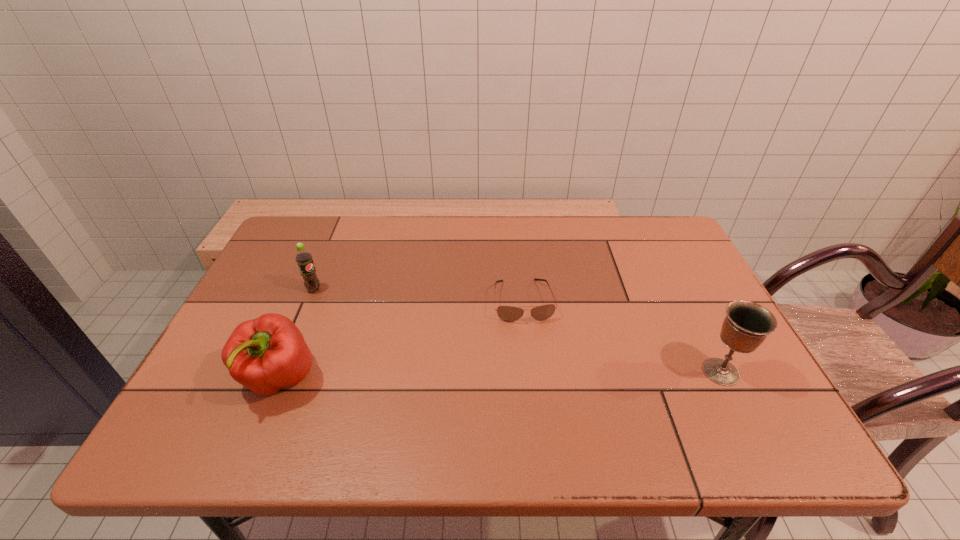
The height and width of the screenshot is (540, 960). I want to click on bell pepper, so click(x=266, y=354).

Where is `chalice`? The height and width of the screenshot is (540, 960). chalice is located at coordinates (746, 325).

This screenshot has height=540, width=960. I want to click on soda, so click(x=303, y=257).

Find the location of a particular element. This screenshot has width=960, height=540. the third object from left to right is located at coordinates (506, 313).

Locate an element on the screen. Image resolution: width=960 pixels, height=540 pixels. the shortest object is located at coordinates (506, 313).

At what (x,y) coordinates should I click in order to perform the action: click on vacant space located on the back of the bell pepper. Please return your answer as a coordinate pair (x, y). Image resolution: width=960 pixels, height=540 pixels. Looking at the image, I should click on (314, 294).

Find the location of `vacant area situated on the back of the chalice`. vacant area situated on the back of the chalice is located at coordinates (694, 318).

Where is `free space located 0.200m on the front label of the soda`? free space located 0.200m on the front label of the soda is located at coordinates (367, 326).

I want to click on vacant space positioned 0.110m on the front label of the soda, so click(x=345, y=310).

Identify the location of vacant space located 0.160m on the front label of the soda. Image resolution: width=960 pixels, height=540 pixels. (356, 319).